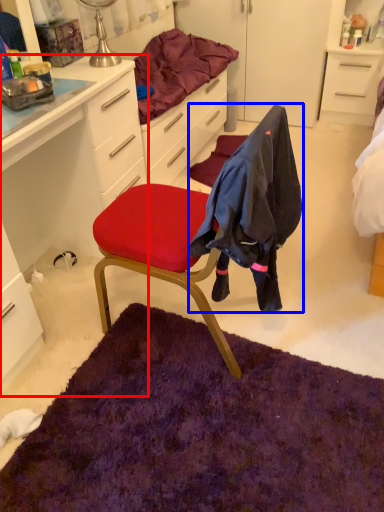
Question: Among these objects, which one is nearest to the camera, cabinetry (highlighted by a red box) or clothing (highlighted by a blue box)?

Choices:
 (A) cabinetry
 (B) clothing

Answer: (B)